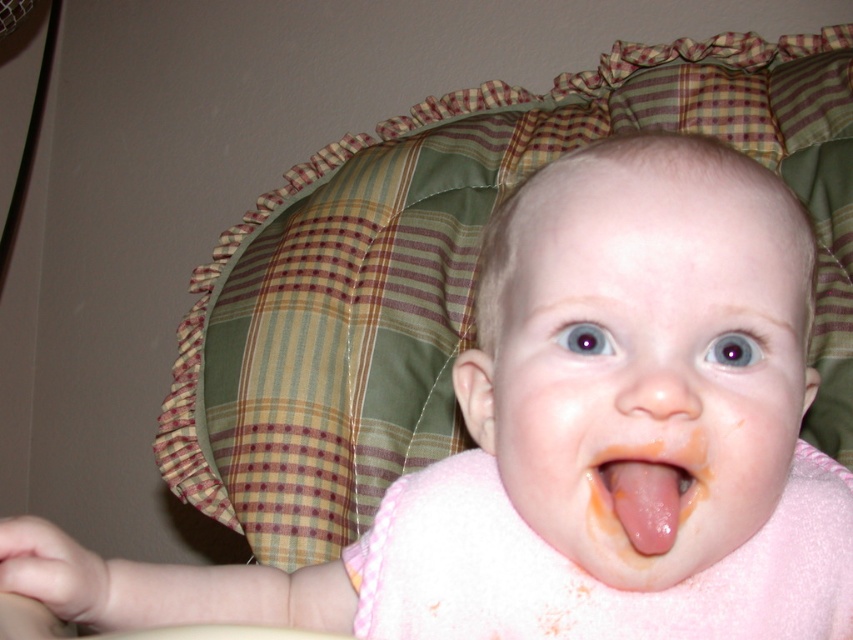
Is pink fabric at center above pink smooth tongue at center?

Answer: Yes, pink fabric at center is above pink smooth tongue at center.

Who is more distant from viewer, (x=627, y=288) or (x=595, y=467)?

The point (x=595, y=467) is behind.

Find the location of a particular element. pink fabric at center is located at coordinates (645, 369).